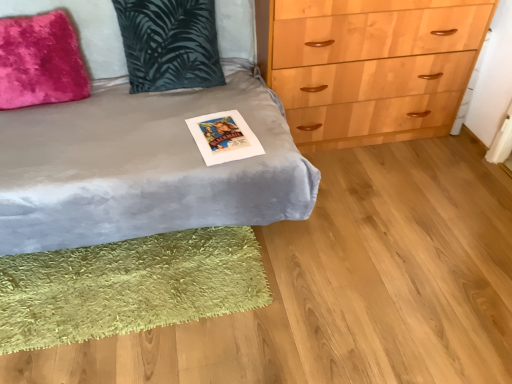
Question: Is the surface of fuzzy pink pillow at upper left, the 1th pillow positioned from the left, in direct contact with green shaggy rug at lower left?

Choices:
 (A) yes
 (B) no

Answer: (B)

Question: Can you confirm if fuzzy pink pillow at upper left, which is the second pillow from right to left, is wider than green shaggy rug at lower left?

Choices:
 (A) no
 (B) yes

Answer: (A)

Question: Is fuzzy pink pillow at upper left, the 1th pillow positioned from the left, taller than green shaggy rug at lower left?

Choices:
 (A) no
 (B) yes

Answer: (B)

Question: Does fuzzy pink pillow at upper left, the 1th pillow positioned from the left, appear on the right side of green shaggy rug at lower left?

Choices:
 (A) no
 (B) yes

Answer: (A)

Question: Is fuzzy pink pillow at upper left, which is the second pillow from right to left, far from green shaggy rug at lower left?

Choices:
 (A) yes
 (B) no

Answer: (B)

Question: Could you tell me if fuzzy pink pillow at upper left, which is the second pillow from right to left, is turned towards green shaggy rug at lower left?

Choices:
 (A) yes
 (B) no

Answer: (B)

Question: Is matte paper postcard at center bigger than velvet gray bed at center?

Choices:
 (A) yes
 (B) no

Answer: (B)

Question: Would you say velvet gray bed at center is part of matte paper postcard at center's contents?

Choices:
 (A) no
 (B) yes

Answer: (A)

Question: Can you confirm if matte paper postcard at center is wider than velvet gray bed at center?

Choices:
 (A) no
 (B) yes

Answer: (A)

Question: From a real-world perspective, does matte paper postcard at center sit lower than velvet gray bed at center?

Choices:
 (A) yes
 (B) no

Answer: (A)

Question: Can you confirm if matte paper postcard at center is shorter than velvet gray bed at center?

Choices:
 (A) yes
 (B) no

Answer: (A)

Question: Is the position of matte paper postcard at center more distant than that of velvet gray bed at center?

Choices:
 (A) yes
 (B) no

Answer: (A)

Question: Does velvet gray bed at center turn towards matte paper postcard at center?

Choices:
 (A) yes
 (B) no

Answer: (A)